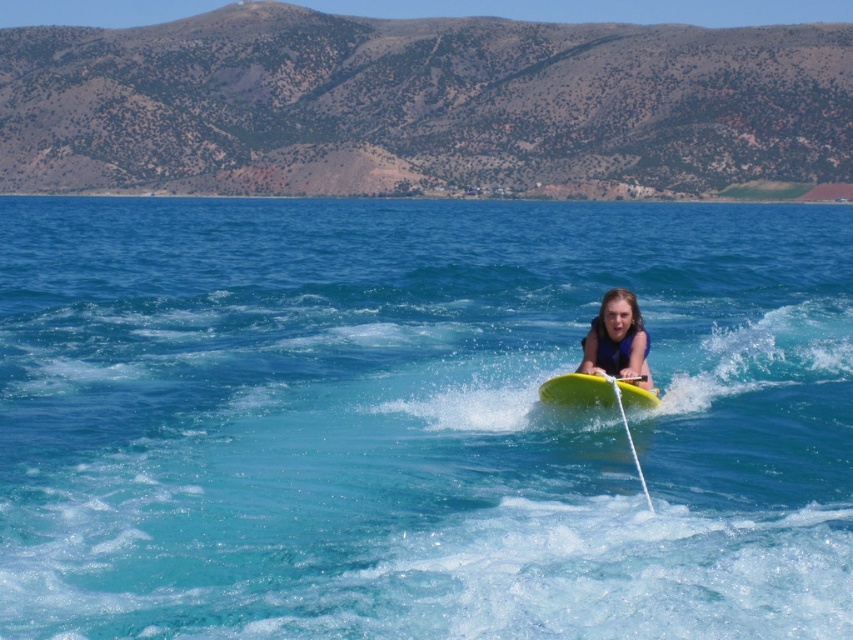
Which is more to the right, translucent blue water at center or yellow foam surfboard at center?

translucent blue water at center

Is point (434, 388) positioned in front of point (553, 380)?

No, (434, 388) is behind (553, 380).

The width and height of the screenshot is (853, 640). Identify the location of translucent blue water at center. (418, 419).

Find the location of a particular element. translucent blue water at center is located at coordinates [x=418, y=419].

Does translucent blue water at center appear over matte yellow surfboard at center?

Yes.

Does point (654, 496) come behind point (596, 358)?

No, (654, 496) is closer to viewer.

You are a GUI agent. You are given a task and a screenshot of the screen. Output one action in this format:
    pyautogui.click(x=<x>, y=<y>)
    Task: Click on the translucent blue water at center
    This screenshot has width=853, height=640.
    Given the screenshot: What is the action you would take?
    pyautogui.click(x=418, y=419)

Is matte yellow surfboard at center wider than yellow foam surfboard at center?

No, matte yellow surfboard at center is not wider than yellow foam surfboard at center.

Where is `matte yellow surfboard at center`? matte yellow surfboard at center is located at coordinates (618, 340).

Which is behind, point (595, 369) or point (561, 376)?

Point (595, 369)

Locate an element on the screen. The image size is (853, 640). matte yellow surfboard at center is located at coordinates (618, 340).